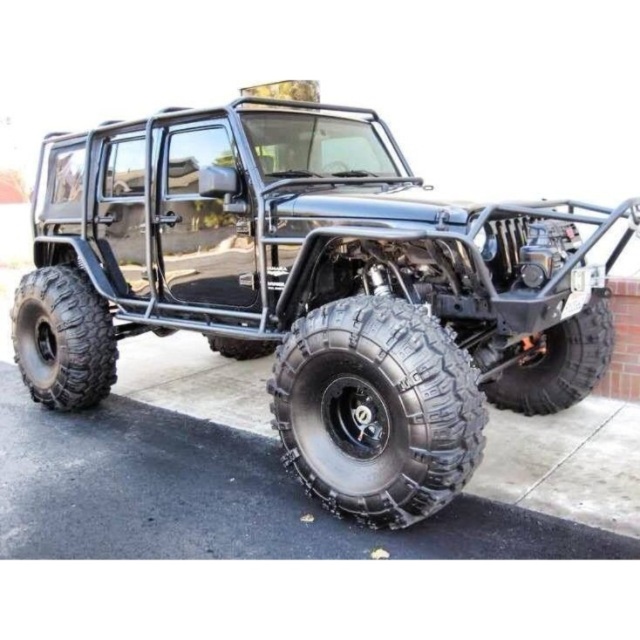
What do you see at coordinates (557, 364) in the screenshot?
I see `black rugged tire at lower right` at bounding box center [557, 364].

Which is more to the left, black rugged tire at lower right or black rubber tire at center?

From the viewer's perspective, black rubber tire at center appears more on the left side.

Which is behind, point (515, 364) or point (342, 172)?

Point (515, 364)

Locate an element on the screen. The image size is (640, 640). black rugged tire at lower right is located at coordinates (557, 364).

Is black matte/texture jeep at center wider than black rubber tire at center?

Yes.

Which is below, black matte/texture jeep at center or black rubber tire at center?

black matte/texture jeep at center is below.

Measure the distance between point (65, 358) and camera.

Point (65, 358) is 4.96 meters from camera.

Find the location of a particular element. The height and width of the screenshot is (640, 640). black matte/texture jeep at center is located at coordinates (314, 288).

Does black matte/texture jeep at center appear on the left side of black rugged tire at lower center?

Correct, you'll find black matte/texture jeep at center to the left of black rugged tire at lower center.

Based on the photo, who is more distant from viewer, (68, 200) or (284, 346)?

The point (68, 200) is more distant.

Is point (60, 218) positioned after point (284, 420)?

That is True.

You are a GUI agent. You are given a task and a screenshot of the screen. Output one action in this format:
    pyautogui.click(x=<x>, y=<y>)
    Task: Click on the black matte/texture jeep at center
    
    Given the screenshot: What is the action you would take?
    pyautogui.click(x=314, y=288)